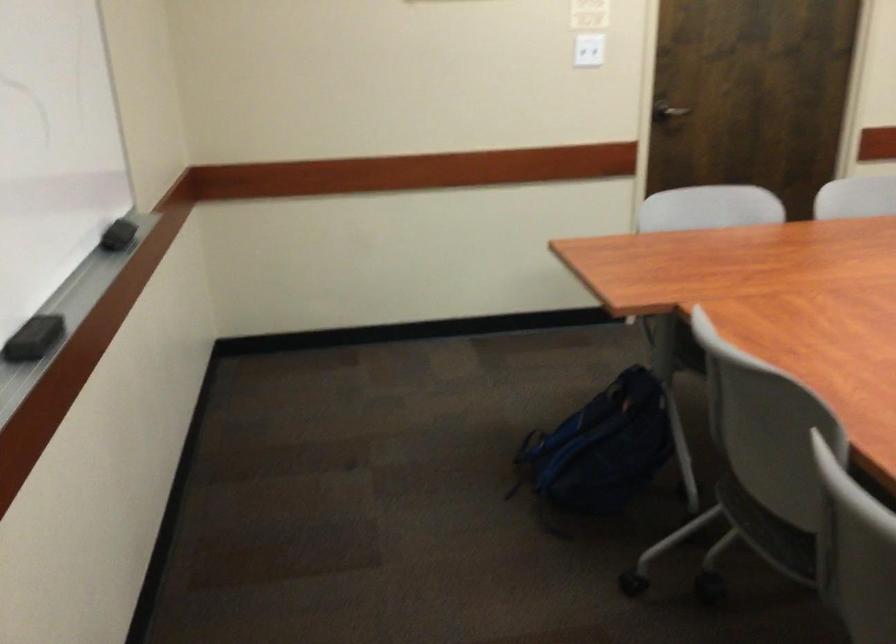
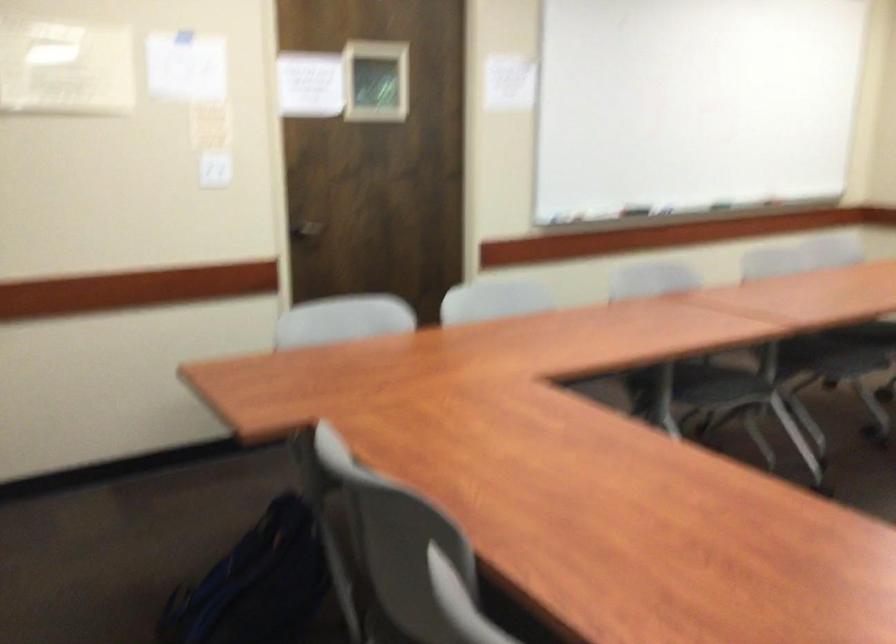
In the second image, find the point that corresponds to point 677,106 in the first image.

(306, 228)